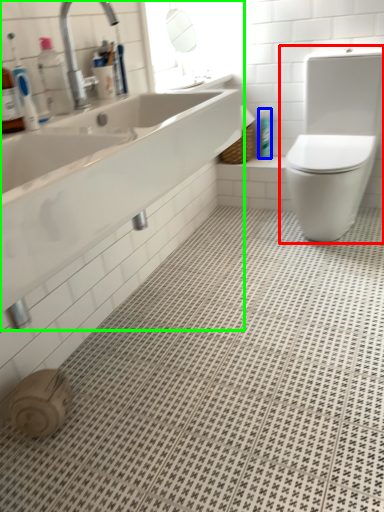
Question: Based on their relative distances, which object is farther from toilet (highlighted by a red box)? Choose from toiletry (highlighted by a blue box) and sink (highlighted by a green box).

Choices:
 (A) toiletry
 (B) sink

Answer: (B)